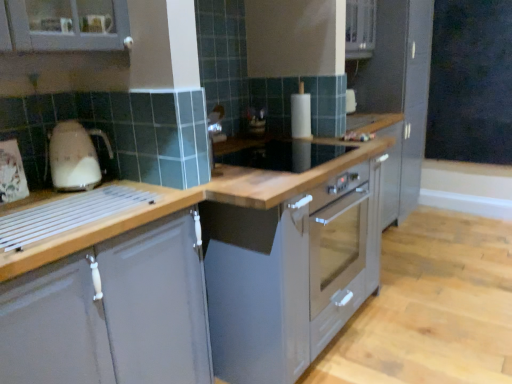
Question: From the image's perspective, is beige glossy kettle at left on top of black matte chalkboard at upper right?

Choices:
 (A) no
 (B) yes

Answer: (A)

Question: Is beige glossy kettle at left smaller than black matte chalkboard at upper right?

Choices:
 (A) no
 (B) yes

Answer: (B)

Question: Is black matte chalkboard at upper right completely or partially inside beige glossy kettle at left?

Choices:
 (A) yes
 (B) no

Answer: (B)

Question: Is beige glossy kettle at left with black matte chalkboard at upper right?

Choices:
 (A) yes
 (B) no

Answer: (B)

Question: Is black matte chalkboard at upper right at the back of beige glossy kettle at left?

Choices:
 (A) yes
 (B) no

Answer: (B)

Question: Is beige glossy kettle at left positioned before black matte chalkboard at upper right?

Choices:
 (A) yes
 (B) no

Answer: (A)

Question: Can we say black matte chalkboard at upper right lies outside satin grey cabinet at right, which appears as the 1th cabinetry when viewed from the right?

Choices:
 (A) yes
 (B) no

Answer: (A)

Question: From the image's perspective, is black matte chalkboard at upper right beneath satin grey cabinet at right, which appears as the 1th cabinetry when viewed from the right?

Choices:
 (A) no
 (B) yes

Answer: (A)

Question: Does black matte chalkboard at upper right have a greater width compared to satin grey cabinet at right, positioned as the 2th cabinetry in bottom-to-top order?

Choices:
 (A) no
 (B) yes

Answer: (A)

Question: Is black matte chalkboard at upper right oriented away from satin grey cabinet at right, the 1th cabinetry in the top-to-bottom sequence?

Choices:
 (A) yes
 (B) no

Answer: (B)

Question: Can you confirm if black matte chalkboard at upper right is thinner than satin grey cabinet at right, which is the 2th cabinetry from left to right?

Choices:
 (A) yes
 (B) no

Answer: (A)

Question: Considering the relative sizes of black matte chalkboard at upper right and satin grey cabinet at right, which is the 2th cabinetry from left to right, in the image provided, is black matte chalkboard at upper right smaller than satin grey cabinet at right, which is the 2th cabinetry from left to right,?

Choices:
 (A) no
 (B) yes

Answer: (B)

Question: Would you say matte gray cabinet at left, placed as the first cabinetry when sorted from front to back, is outside satin grey cabinet at right, which appears as the 1th cabinetry when viewed from the right?

Choices:
 (A) no
 (B) yes

Answer: (B)